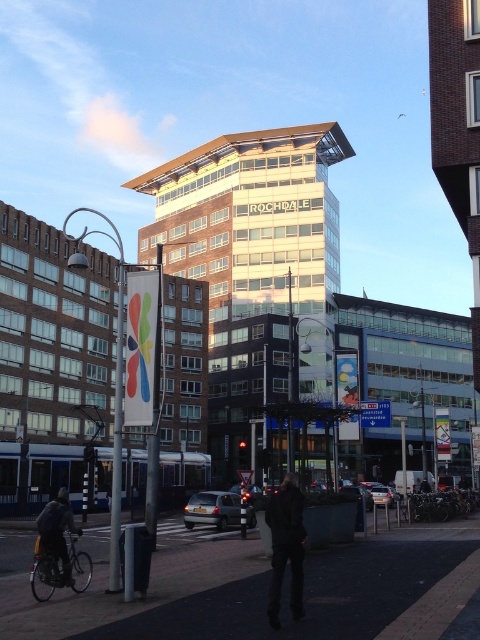
Question: Is white plastic banner at center further to the viewer compared to dark blue jacket at lower left?

Choices:
 (A) no
 (B) yes

Answer: (B)

Question: Which point is farther from the camera taking this photo?

Choices:
 (A) 283,508
 (B) 60,515

Answer: (B)

Question: Estimate the real-world distances between objects in this image. Which object is closer to the dark fabric jacket at center?

Choices:
 (A) white plastic banner at center
 (B) dark blue jacket at lower left

Answer: (B)

Question: Does dark fabric jacket at center have a larger size compared to white plastic banner at center?

Choices:
 (A) yes
 (B) no

Answer: (B)

Question: Is dark fabric jacket at center closer to camera compared to white plastic banner at center?

Choices:
 (A) yes
 (B) no

Answer: (A)

Question: Which of these objects is positioned closest to the dark fabric jacket at center?

Choices:
 (A) dark blue jacket at lower left
 (B) white plastic banner at center

Answer: (A)